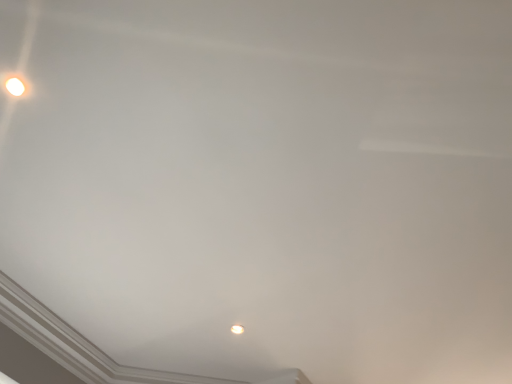
Question: Which direction should I rotate to look at matte white lamp at center, arranged as the first lamp when viewed from the right, — up or down?

Choices:
 (A) up
 (B) down

Answer: (B)

Question: Is matte white lamp at upper left, the first lamp in the top-to-bottom sequence, further to camera compared to matte white lamp at center, arranged as the first lamp when viewed from the right?

Choices:
 (A) yes
 (B) no

Answer: (B)

Question: Is matte white lamp at upper left, positioned as the first lamp in front-to-back order, smaller than matte white lamp at center, acting as the 1th lamp starting from the bottom?

Choices:
 (A) no
 (B) yes

Answer: (A)

Question: From the image's perspective, does matte white lamp at upper left, which ranks as the first lamp in left-to-right order, appear lower than matte white lamp at center, which is the second lamp in left-to-right order?

Choices:
 (A) no
 (B) yes

Answer: (A)

Question: Considering the relative sizes of matte white lamp at upper left, positioned as the first lamp in front-to-back order, and matte white lamp at center, the first lamp viewed from the back, in the image provided, is matte white lamp at upper left, positioned as the first lamp in front-to-back order, shorter than matte white lamp at center, the first lamp viewed from the back,?

Choices:
 (A) yes
 (B) no

Answer: (B)

Question: From a real-world perspective, is matte white lamp at upper left, which ranks as the first lamp in left-to-right order, over matte white lamp at center, the first lamp viewed from the back?

Choices:
 (A) no
 (B) yes

Answer: (A)

Question: Is matte white lamp at upper left, which is the 2th lamp in bottom-to-top order, looking in the opposite direction of matte white lamp at center, the first lamp viewed from the back?

Choices:
 (A) no
 (B) yes

Answer: (A)

Question: Does matte white lamp at center, the second lamp from the front, have a greater height compared to matte white lamp at upper left, which ranks as the first lamp in left-to-right order?

Choices:
 (A) no
 (B) yes

Answer: (A)

Question: Is matte white lamp at center, arranged as the first lamp when viewed from the right, in front of matte white lamp at upper left, which is the second lamp from back to front?

Choices:
 (A) yes
 (B) no

Answer: (B)

Question: From a real-world perspective, is matte white lamp at center, the second lamp from the front, located higher than matte white lamp at upper left, the first lamp in the top-to-bottom sequence?

Choices:
 (A) no
 (B) yes

Answer: (B)

Question: Is matte white lamp at upper left, acting as the second lamp starting from the right, a part of matte white lamp at center, acting as the 1th lamp starting from the bottom?

Choices:
 (A) yes
 (B) no

Answer: (B)

Question: From a real-world perspective, does matte white lamp at center, the first lamp viewed from the back, sit lower than matte white lamp at upper left, the first lamp in the top-to-bottom sequence?

Choices:
 (A) yes
 (B) no

Answer: (B)

Question: From the image's perspective, would you say matte white lamp at center, arranged as the first lamp when viewed from the right, is positioned over matte white lamp at upper left, the first lamp in the top-to-bottom sequence?

Choices:
 (A) yes
 (B) no

Answer: (B)

Question: Is matte white lamp at center, which is the second lamp in left-to-right order, situated inside matte white lamp at upper left, which is the second lamp from back to front, or outside?

Choices:
 (A) inside
 (B) outside

Answer: (B)